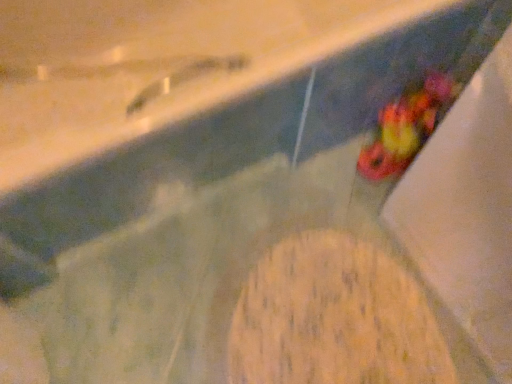
Question: Which direction should I rotate to face wooden cutting board at center, the first food when ordered from bottom to top, — up or down?

Choices:
 (A) up
 (B) down

Answer: (B)

Question: Is multicolored plastic toy at lower right, arranged as the second food when ordered from the bottom, aimed at wooden cutting board at center, the first food when ordered from bottom to top?

Choices:
 (A) yes
 (B) no

Answer: (B)

Question: Does multicolored plastic toy at lower right, marked as the first food in a top-to-bottom arrangement, appear on the right side of wooden cutting board at center, the first food when ordered from bottom to top?

Choices:
 (A) no
 (B) yes

Answer: (B)

Question: Can you confirm if multicolored plastic toy at lower right, arranged as the second food when ordered from the bottom, is smaller than wooden cutting board at center, which is the second food in top-to-bottom order?

Choices:
 (A) no
 (B) yes

Answer: (B)

Question: Is the depth of multicolored plastic toy at lower right, marked as the first food in a top-to-bottom arrangement, greater than that of wooden cutting board at center, which is the second food in top-to-bottom order?

Choices:
 (A) no
 (B) yes

Answer: (B)

Question: Is multicolored plastic toy at lower right, marked as the first food in a top-to-bottom arrangement, closer to the viewer compared to wooden cutting board at center, which is the second food in top-to-bottom order?

Choices:
 (A) yes
 (B) no

Answer: (B)

Question: Is multicolored plastic toy at lower right, arranged as the second food when ordered from the bottom, wider than wooden cutting board at center, which is the second food in top-to-bottom order?

Choices:
 (A) no
 (B) yes

Answer: (A)

Question: Is wooden cutting board at center, the first food when ordered from bottom to top, located outside multicolored plastic toy at lower right, marked as the first food in a top-to-bottom arrangement?

Choices:
 (A) no
 (B) yes

Answer: (B)

Question: From a real-world perspective, is wooden cutting board at center, which is the second food in top-to-bottom order, physically above multicolored plastic toy at lower right, marked as the first food in a top-to-bottom arrangement?

Choices:
 (A) yes
 (B) no

Answer: (B)

Question: Does wooden cutting board at center, which is the second food in top-to-bottom order, contain multicolored plastic toy at lower right, marked as the first food in a top-to-bottom arrangement?

Choices:
 (A) no
 (B) yes

Answer: (A)

Question: Is wooden cutting board at center, which is the second food in top-to-bottom order, at the left side of multicolored plastic toy at lower right, arranged as the second food when ordered from the bottom?

Choices:
 (A) yes
 (B) no

Answer: (A)

Question: Is wooden cutting board at center, the first food when ordered from bottom to top, aimed at multicolored plastic toy at lower right, arranged as the second food when ordered from the bottom?

Choices:
 (A) no
 (B) yes

Answer: (A)

Question: Considering the relative sizes of wooden cutting board at center, which is the second food in top-to-bottom order, and multicolored plastic toy at lower right, marked as the first food in a top-to-bottom arrangement, in the image provided, is wooden cutting board at center, which is the second food in top-to-bottom order, bigger than multicolored plastic toy at lower right, marked as the first food in a top-to-bottom arrangement,?

Choices:
 (A) yes
 (B) no

Answer: (A)

Question: In the image, is wooden cutting board at center, which is the second food in top-to-bottom order, positioned in front of or behind multicolored plastic toy at lower right, marked as the first food in a top-to-bottom arrangement?

Choices:
 (A) front
 (B) behind

Answer: (A)